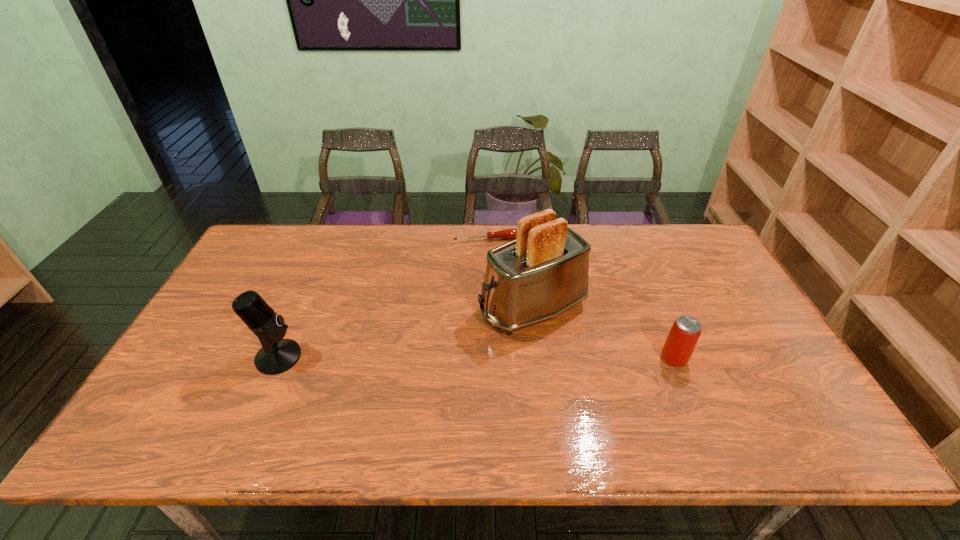
This screenshot has width=960, height=540. In the image, there is a desktop. Identify the location of vacant space at the far right corner. (705, 266).

Where is `free area in between the toaster and the rightmost object`? This screenshot has height=540, width=960. free area in between the toaster and the rightmost object is located at coordinates (603, 334).

This screenshot has width=960, height=540. In order to click on free space between the farthest object and the third shortest object in this screenshot , I will do `click(383, 298)`.

This screenshot has height=540, width=960. Identify the location of unoccupied position between the third tallest object and the second tallest object. (476, 358).

Locate an element on the screen. unoccupied area between the tallest object and the rightmost object is located at coordinates (603, 334).

Where is `free space between the second tallest object and the screwdriver`? This screenshot has width=960, height=540. free space between the second tallest object and the screwdriver is located at coordinates (383, 298).

The image size is (960, 540). In order to click on blank region between the beer can and the third shortest object in this screenshot , I will do `click(476, 358)`.

Find the location of a particular element. vacant point located between the tallest object and the second shortest object is located at coordinates (603, 334).

Where is `vacant space in between the tallest object and the third shortest object`? Image resolution: width=960 pixels, height=540 pixels. vacant space in between the tallest object and the third shortest object is located at coordinates (406, 333).

I want to click on blank region between the tallest object and the third shortest object, so click(406, 333).